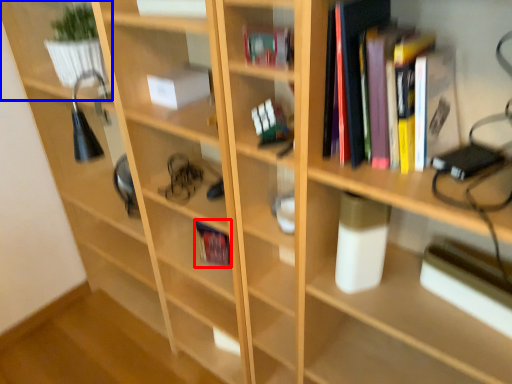
Question: Which point is closer to the camera, book (highlighted by a red box) or shelf (highlighted by a blue box)?

Choices:
 (A) book
 (B) shelf

Answer: (B)